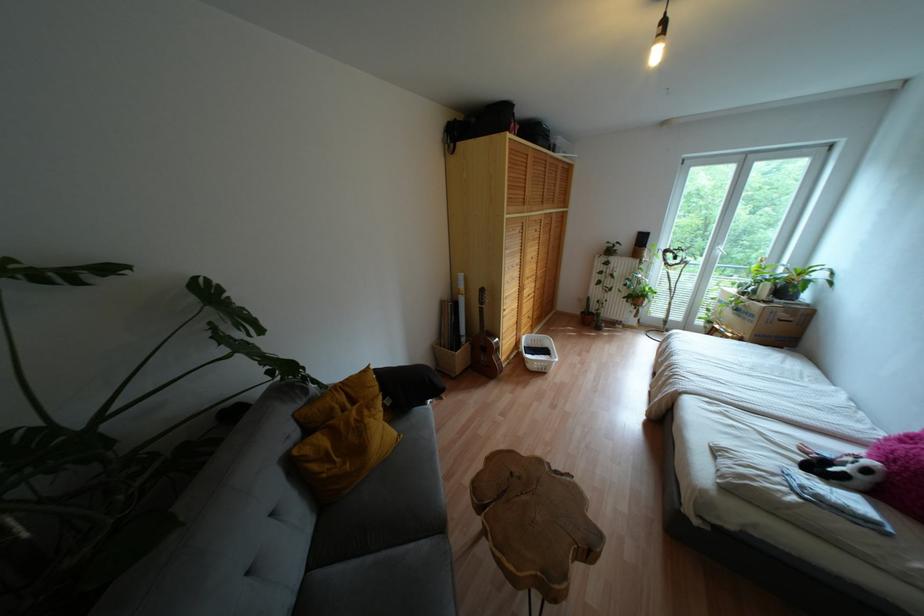
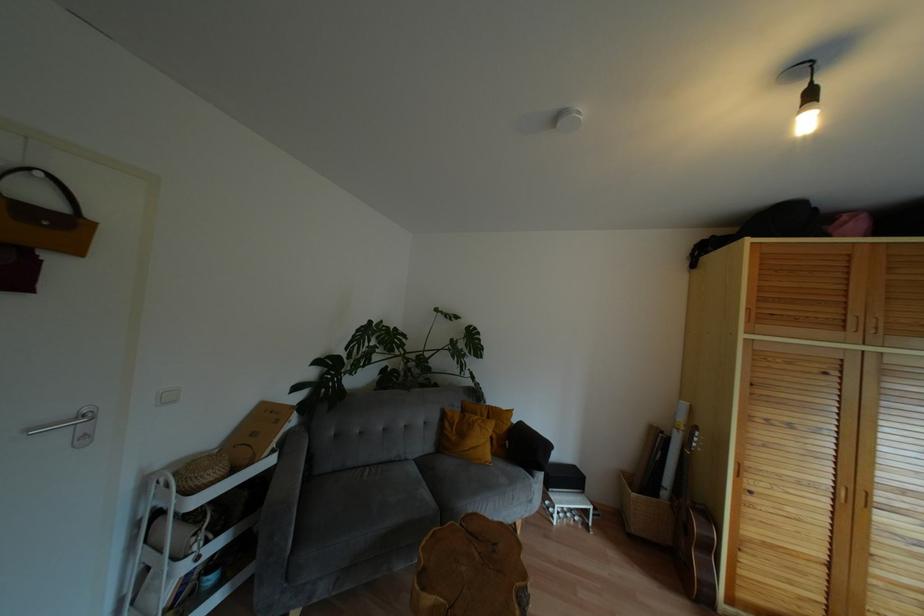
The point at (369, 559) is marked in the first image. Where is the corresponding point in the second image?

(419, 476)